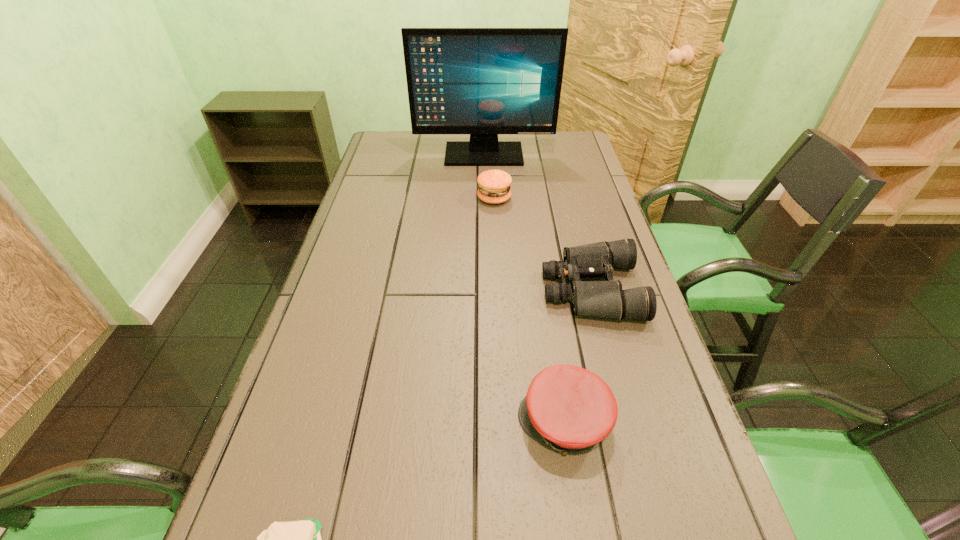
At what (x,y) coordinates should I click in order to perform the action: click on monitor. Please return your answer as a coordinate pair (x, y). The width and height of the screenshot is (960, 540). Looking at the image, I should click on (480, 81).

This screenshot has width=960, height=540. Identify the location of the tallest object. (480, 81).

Where is `the right patty`? Image resolution: width=960 pixels, height=540 pixels. the right patty is located at coordinates (494, 185).

Find the location of a particular element. the taller patty is located at coordinates (494, 185).

This screenshot has width=960, height=540. What are the coordinates of `the third farthest object` in the screenshot? It's located at (606, 299).

The image size is (960, 540). Find the location of `the fourth farthest object`. the fourth farthest object is located at coordinates (571, 409).

Where is `free point located 0.380m on the screen side of the monitor`? Image resolution: width=960 pixels, height=540 pixels. free point located 0.380m on the screen side of the monitor is located at coordinates (485, 232).

Where is `vacant space positioned on the front of the farther patty`? The width and height of the screenshot is (960, 540). vacant space positioned on the front of the farther patty is located at coordinates (498, 293).

Identify the location of blank area located through the eyepieces of the binoculars. (470, 290).

Find the location of a particular element. free space located 0.060m through the eyepieces of the binoculars is located at coordinates (518, 290).